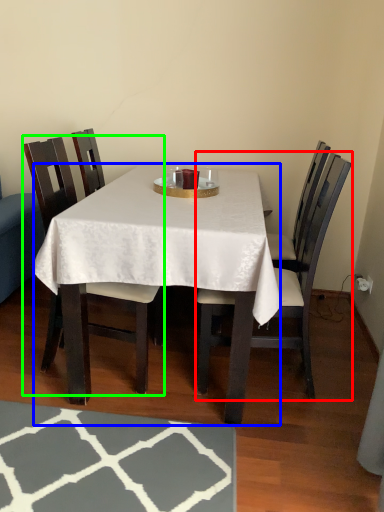
Question: Considering the real-world distances, which object is farthest from chair (highlighted by a red box)? desk (highlighted by a blue box) or chair (highlighted by a green box)?

Choices:
 (A) desk
 (B) chair

Answer: (B)